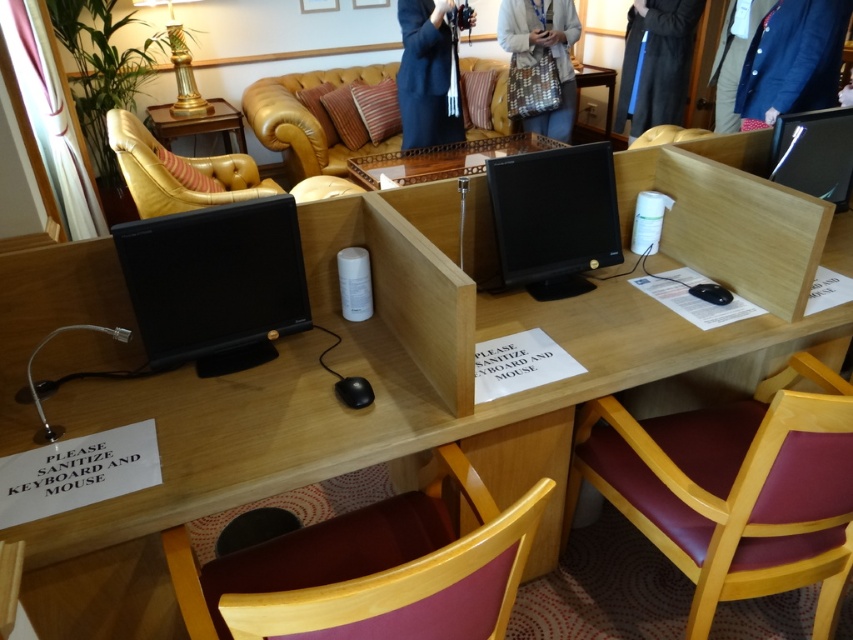
Does wooden desk at center lie in front of dark blue robe at upper right?

Yes, it is in front of dark blue robe at upper right.

Between wooden desk at center and dark blue robe at upper right, which one is positioned higher?

Positioned higher is dark blue robe at upper right.

Is point (117, 404) closer to camera compared to point (631, 10)?

Yes.

I want to click on wooden desk at center, so click(x=457, y=355).

From the picture: Can you confirm if matte black monitor at left is shorter than wooden table at upper left?

Yes.

Does matte black monitor at left appear over wooden table at upper left?

No.

Who is more distant from viewer, [172,244] or [227,102]?

The point [227,102] is more distant.

The image size is (853, 640). I want to click on matte black monitor at left, so click(x=215, y=284).

Can you confirm if purple fabric chair at lower center is positioned above metallic silver monitor at upper right?

No.

Is purple fabric chair at lower center positioned at the back of metallic silver monitor at upper right?

No, it is in front of metallic silver monitor at upper right.

Identify the location of purple fabric chair at lower center. The height and width of the screenshot is (640, 853). (368, 570).